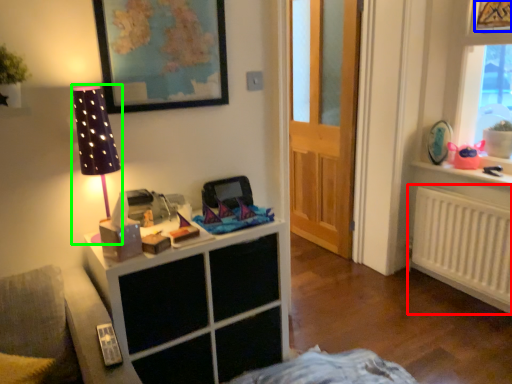
Question: Based on their relative distances, which object is nearer to radiator (highlighted by a red box)? Choose from picture frame (highlighted by a blue box) and table lamp (highlighted by a green box).

Choices:
 (A) picture frame
 (B) table lamp

Answer: (A)